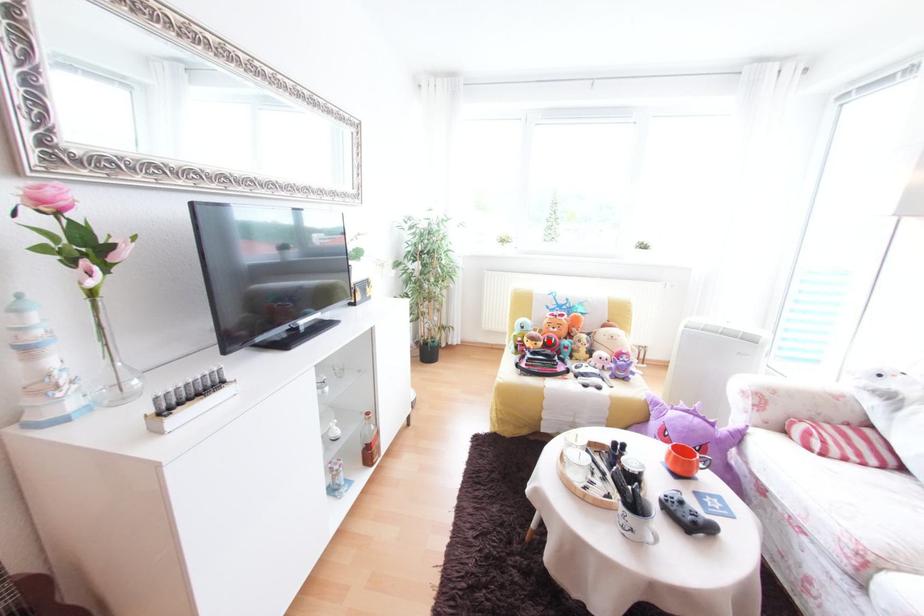
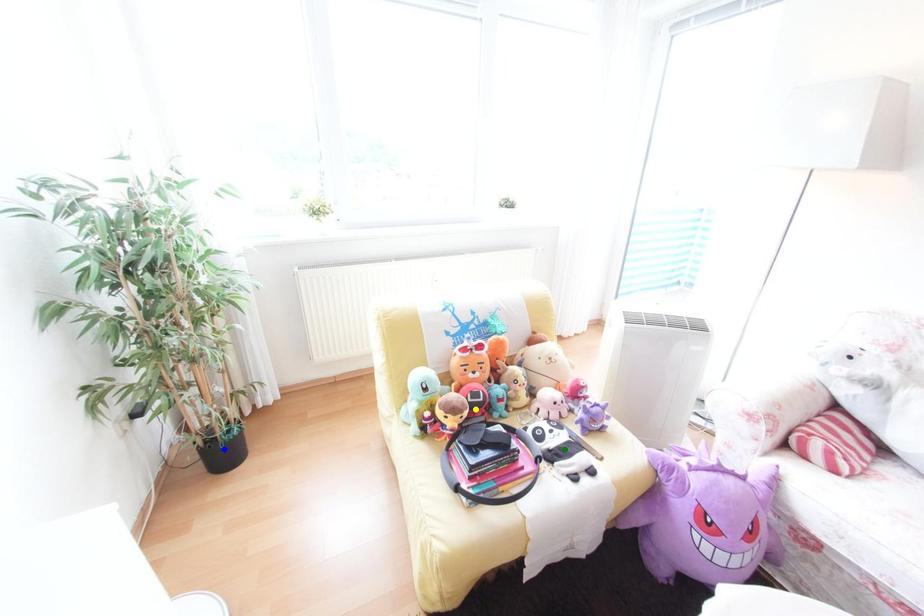
Question: I am providing you with two images of the same scene from different viewpoints. A red point is marked on the first image. You are given multiple points on the second image. Which point in image 2 represents the same 3d spot as the red point in image 1?

Choices:
 (A) yellow point
 (B) green point
 (C) blue point

Answer: (A)